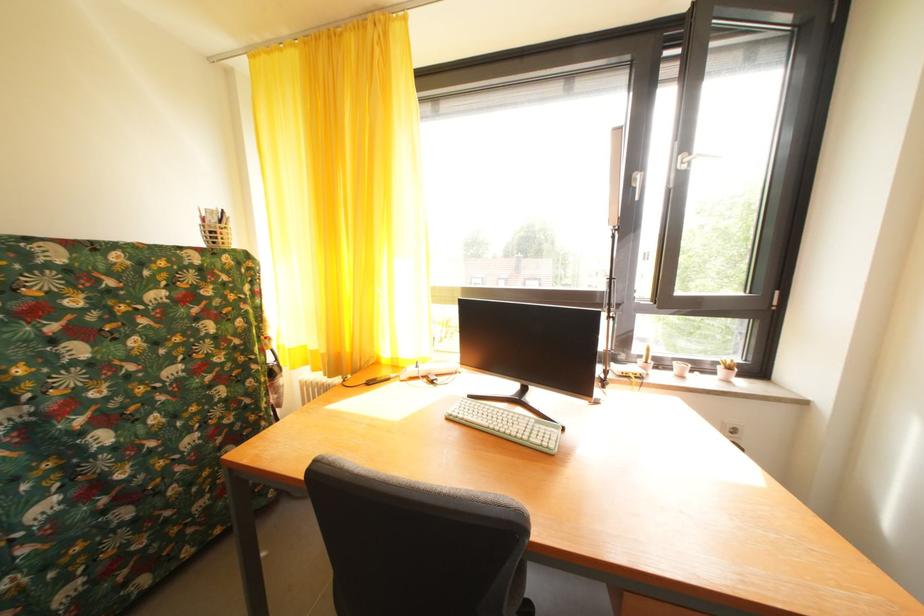
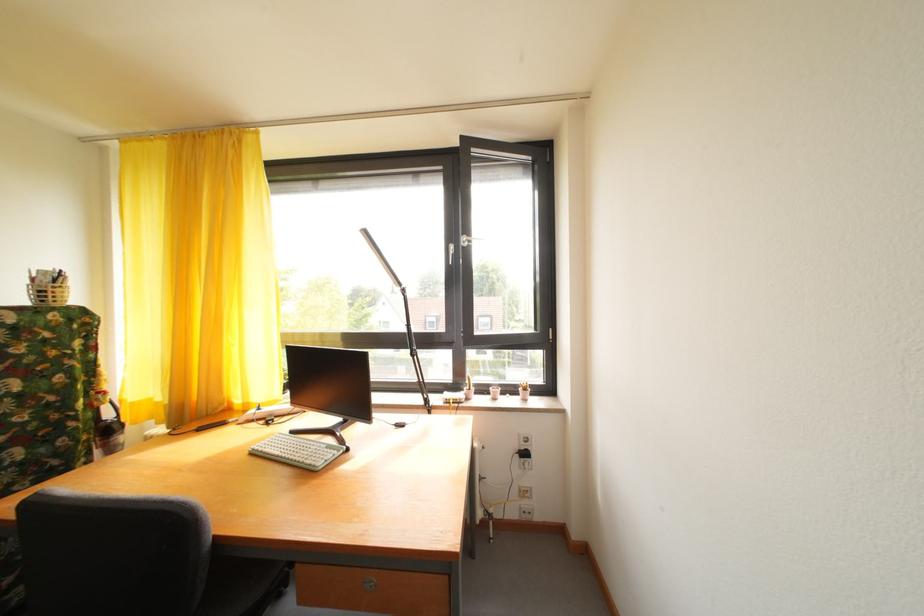
Find the pixel in the second image that matches (x=670, y=370) in the first image.

(492, 395)